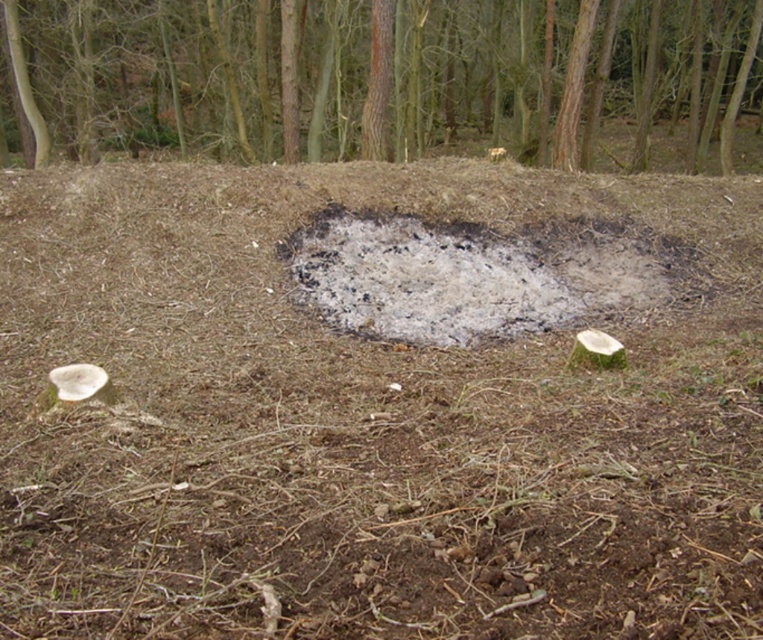
From the picture: You are standing in the forest scene described. You want to reach a water source that is located behind the brown wood tree at upper center. Considering the distance, can you estimate how far you need to walk to get there?

The brown wood tree at upper center is 33.74 feet away from the viewer. Since the water source is behind it, you would need to walk approximately 33.74 feet to reach it.

Based on the photo, you are a hiker navigating through the forest and want to reach a point located at coordinates point (504,145). You are currently standing at point (601,284). Which direction should you move to get closer to your destination?

To reach point (504,145) from point (601,284), you should move backward since point (504,145) is behind point (601,284) from your current position.

You are a park ranger who needs to assess the safety of the area. You have a measuring tape that can extend up to 10 meters. Can you safely measure the distance between the brown wood tree at upper center and the ashy gray ash at center without stepping into the ash?

The distance between the brown wood tree at upper center and the ashy gray ash at center is 9.89 meters, which is just under the 10 meter limit of your measuring tape. Therefore, you can safely measure the distance without needing to step into the ash.